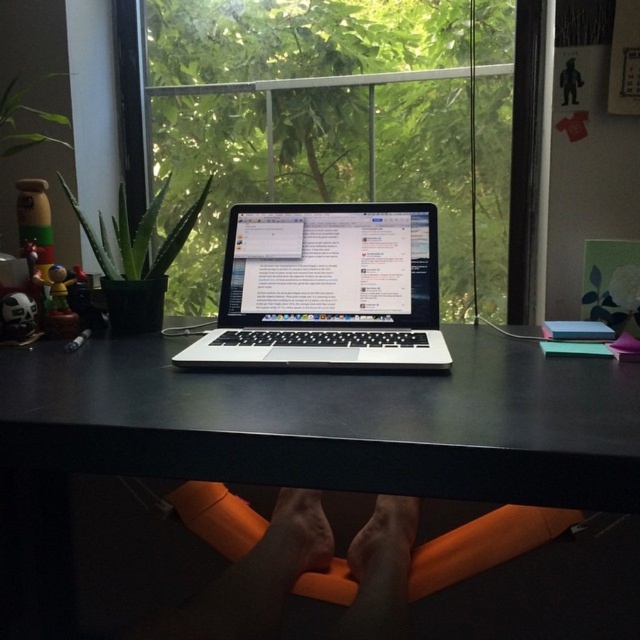
Can you confirm if black matte computer desk at center is taller than silver/black laptop at center?

No.

Which is above, black matte computer desk at center or silver/black laptop at center?

silver/black laptop at center

Does point (81, 356) come behind point (236, 320)?

No, it is in front of (236, 320).

Locate an element on the screen. The image size is (640, 640). black matte computer desk at center is located at coordinates (346, 420).

Between transparent glass window at center and silver/black laptop at center, which one appears on the right side from the viewer's perspective?

Positioned to the right is silver/black laptop at center.

Which of these two, transparent glass window at center or silver/black laptop at center, stands taller?

With more height is transparent glass window at center.

Between point (324, 106) and point (385, 355), which one is positioned in front?

Point (385, 355)

Locate an element on the screen. This screenshot has height=640, width=640. transparent glass window at center is located at coordinates (340, 125).

Who is positioned more to the right, transparent glass window at center or black matte computer desk at center?

transparent glass window at center is more to the right.

How much distance is there between transparent glass window at center and black matte computer desk at center?

transparent glass window at center and black matte computer desk at center are 26.66 inches apart from each other.

The image size is (640, 640). What do you see at coordinates (340, 125) in the screenshot? I see `transparent glass window at center` at bounding box center [340, 125].

You are a GUI agent. You are given a task and a screenshot of the screen. Output one action in this format:
    pyautogui.click(x=<x>, y=<y>)
    Task: Click on the transparent glass window at center
    
    Given the screenshot: What is the action you would take?
    pyautogui.click(x=340, y=125)